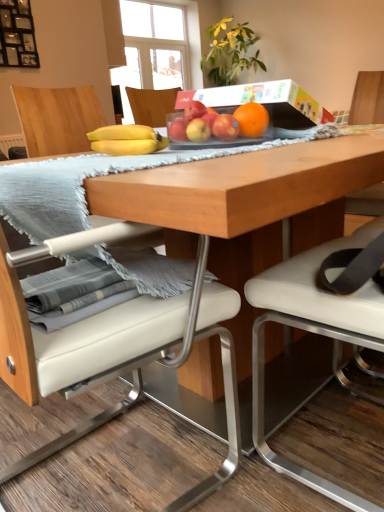
What are the coordinates of `vacant area that is in front of red matte apple at center, acting as the 4th apple starting from the right` in the screenshot? It's located at (173, 142).